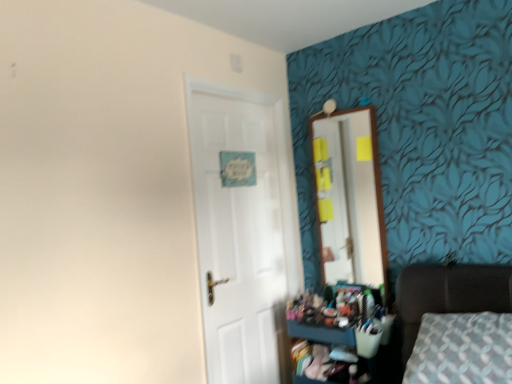
Question: Would you consider white glossy door at center to be distant from wooden dresser at lower right?

Choices:
 (A) yes
 (B) no

Answer: (B)

Question: Is white glossy door at center outside of wooden dresser at lower right?

Choices:
 (A) yes
 (B) no

Answer: (A)

Question: From the image's perspective, is white glossy door at center on wooden dresser at lower right?

Choices:
 (A) no
 (B) yes

Answer: (B)

Question: Does white glossy door at center turn towards wooden dresser at lower right?

Choices:
 (A) yes
 (B) no

Answer: (A)

Question: Is white glossy door at center bigger than wooden dresser at lower right?

Choices:
 (A) yes
 (B) no

Answer: (A)

Question: Does point (326, 332) appear closer or farther from the camera than point (414, 306)?

Choices:
 (A) closer
 (B) farther

Answer: (B)

Question: From a real-world perspective, is wooden dresser at lower right positioned above or below dark brown leather bed at lower right?

Choices:
 (A) below
 (B) above

Answer: (A)

Question: Would you say wooden dresser at lower right is to the left or to the right of dark brown leather bed at lower right in the picture?

Choices:
 (A) left
 (B) right

Answer: (A)

Question: Considering the positions of wooden dresser at lower right and dark brown leather bed at lower right in the image, is wooden dresser at lower right wider or thinner than dark brown leather bed at lower right?

Choices:
 (A) wide
 (B) thin

Answer: (B)

Question: From the image's perspective, is white glossy door at center above or below wooden mirror at upper right?

Choices:
 (A) below
 (B) above

Answer: (A)

Question: Based on their positions, is white glossy door at center located to the left or right of wooden mirror at upper right?

Choices:
 (A) right
 (B) left

Answer: (B)

Question: From their relative heights in the image, would you say white glossy door at center is taller or shorter than wooden mirror at upper right?

Choices:
 (A) tall
 (B) short

Answer: (A)

Question: Choose the correct answer: Is white glossy door at center inside wooden mirror at upper right or outside it?

Choices:
 (A) inside
 (B) outside

Answer: (B)

Question: In terms of size, does dark brown leather bed at lower right appear bigger or smaller than white glossy door at center?

Choices:
 (A) big
 (B) small

Answer: (A)

Question: Considering the positions of dark brown leather bed at lower right and white glossy door at center in the image, is dark brown leather bed at lower right taller or shorter than white glossy door at center?

Choices:
 (A) tall
 (B) short

Answer: (B)